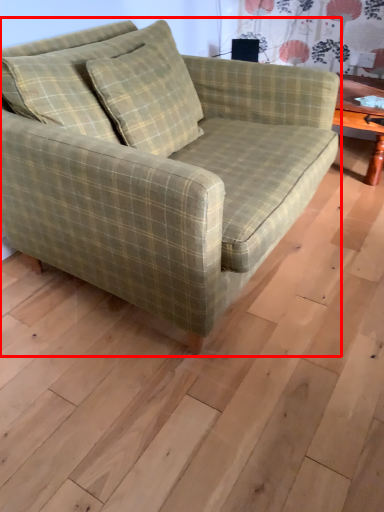
Question: Observing the image, what is the correct spatial positioning of studio couch (annotated by the red box) in reference to pillow?

Choices:
 (A) right
 (B) left

Answer: (A)